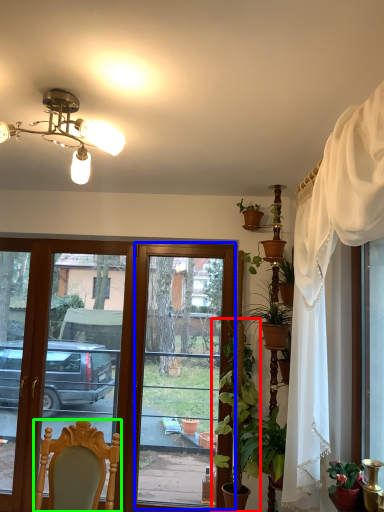
Question: Which object is the closest to the houseplant (highlighted by a red box)? Choose among these: window screen (highlighted by a blue box) or chair (highlighted by a green box).

Choices:
 (A) window screen
 (B) chair

Answer: (B)